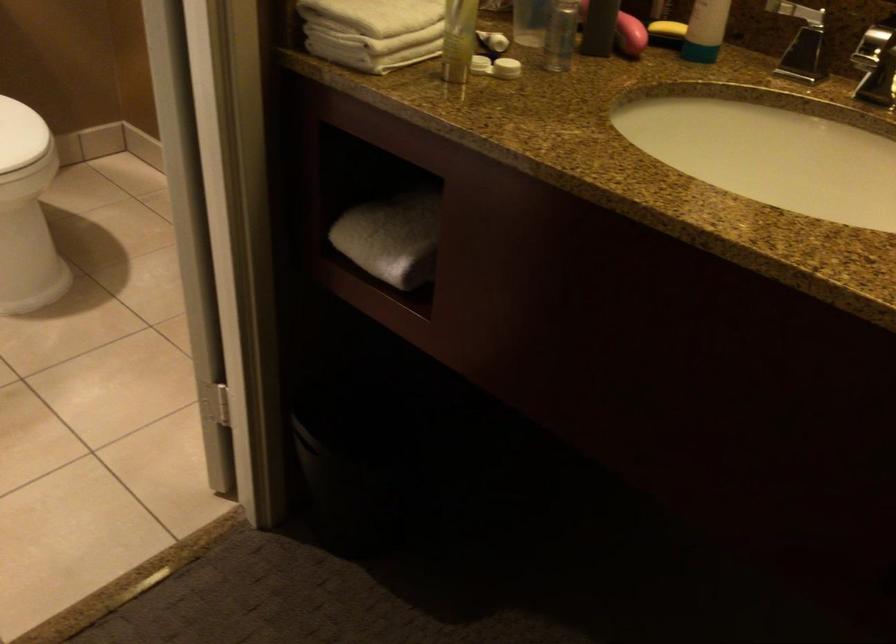
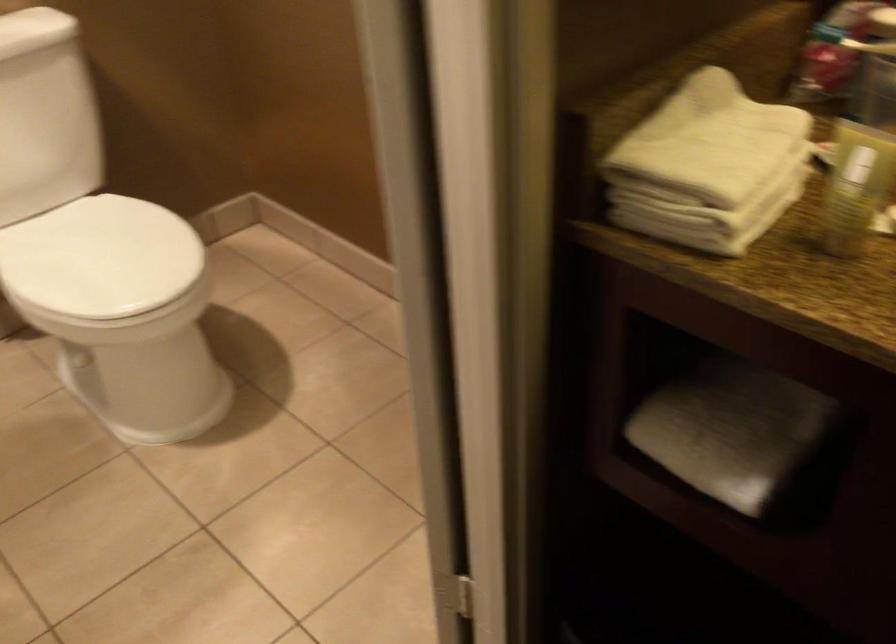
Question: The camera is either moving clockwise (left) or counter-clockwise (right) around the object. The first image is from the beginning of the video and the second image is from the end. Is the camera moving left or right when shooting the video?

Choices:
 (A) Left
 (B) Right

Answer: (B)